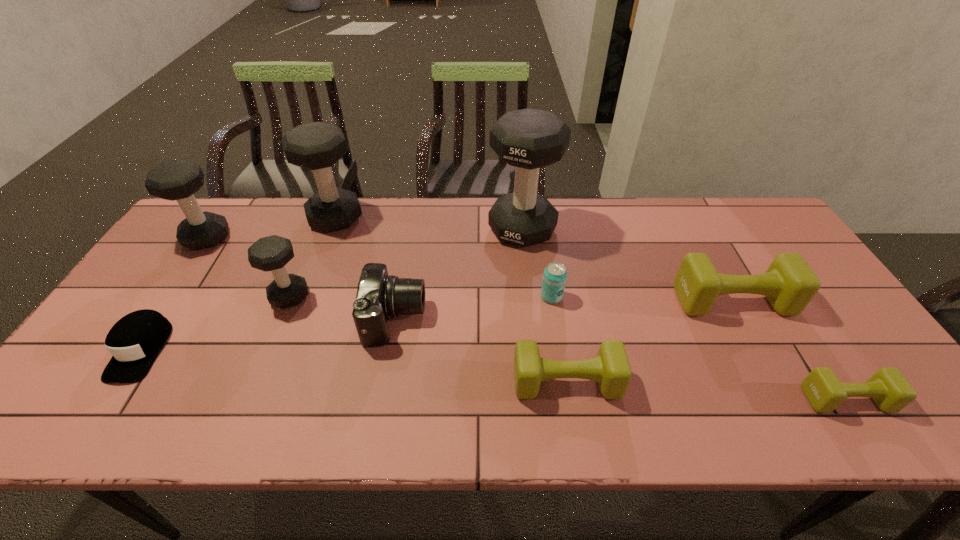
In order to click on the biggest gray dumbbell in this screenshot , I will do `click(529, 139)`.

Locate an element on the screen. This screenshot has height=540, width=960. the tallest dumbbell is located at coordinates (529, 139).

The height and width of the screenshot is (540, 960). I want to click on the second tallest dumbbell, so click(317, 146).

Identify the location of the second biggest gray dumbbell. Image resolution: width=960 pixels, height=540 pixels. click(x=317, y=146).

This screenshot has height=540, width=960. Identify the location of the eighth shortest object. (178, 180).

This screenshot has width=960, height=540. I want to click on the leftmost dumbbell, so click(178, 180).

Locate an element on the screen. the fourth tallest object is located at coordinates (272, 253).

Where is `the nearest gray dumbbell`? the nearest gray dumbbell is located at coordinates (272, 253).

This screenshot has width=960, height=540. I want to click on the sixth object from right to left, so point(379,296).

Image resolution: width=960 pixels, height=540 pixels. I want to click on the fifth tallest dumbbell, so click(789, 284).